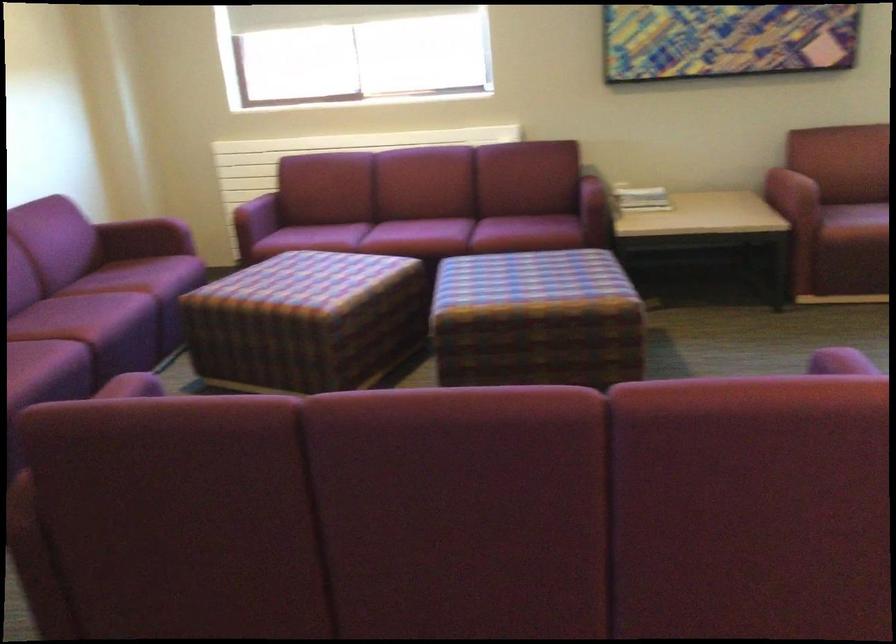
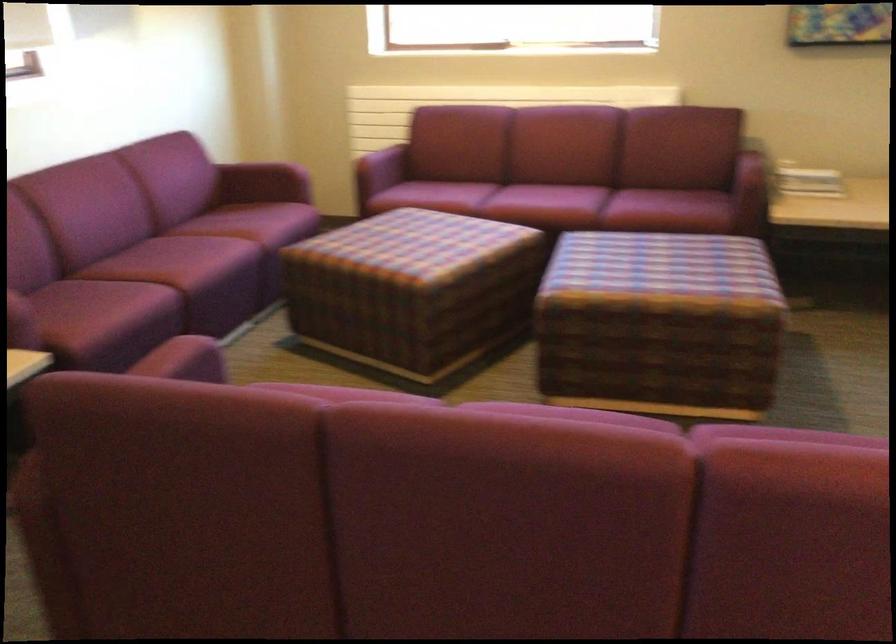
In the second image, find the point that corresponds to (x=124, y=395) in the first image.

(182, 359)